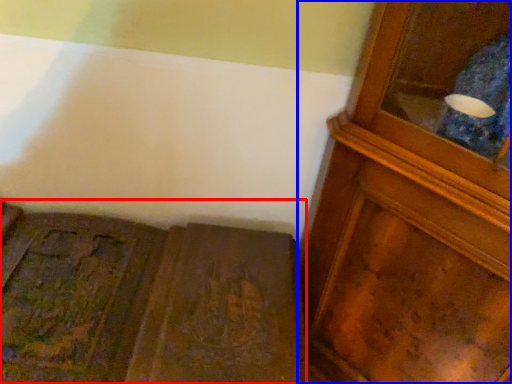
Question: Which of the following is the closest to the observer, furniture (highlighted by a red box) or cupboard (highlighted by a blue box)?

Choices:
 (A) furniture
 (B) cupboard

Answer: (B)